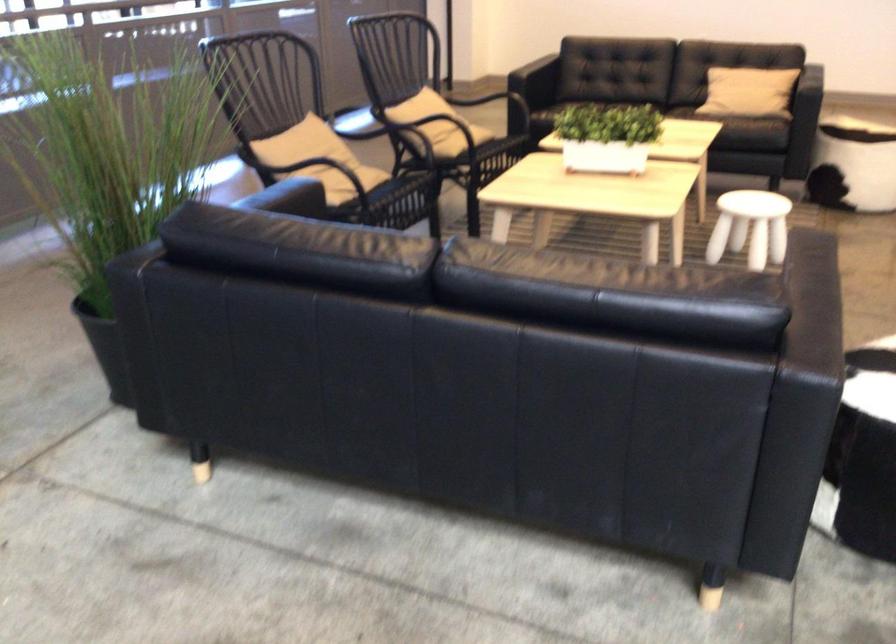
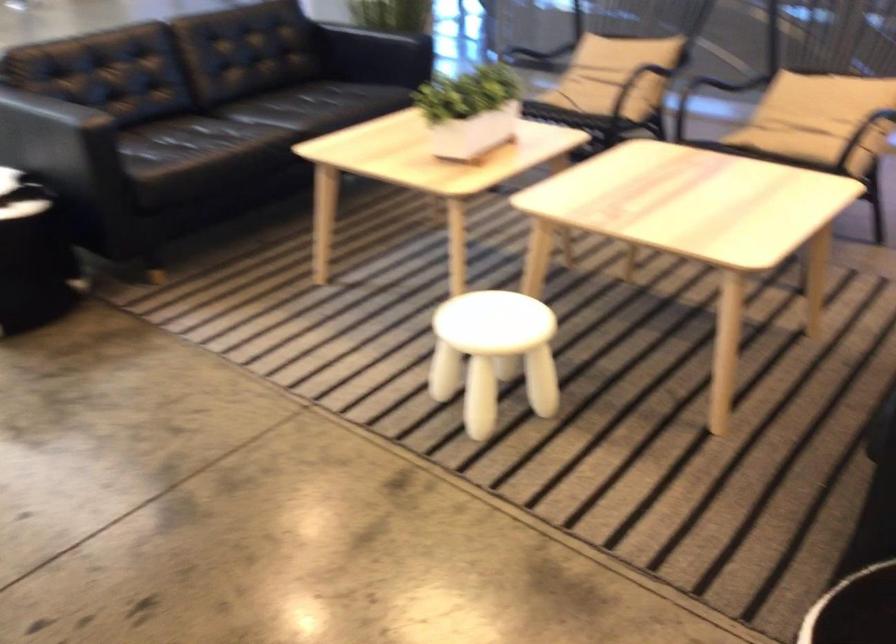
Question: I am providing you with two images of the same scene from different viewpoints. Which of the following objects are not visible in image2?

Choices:
 (A) silver water kettle
 (B) sofa sitting surface
 (C) white stool
 (D) patterned cylindrical ottoman

Answer: (D)